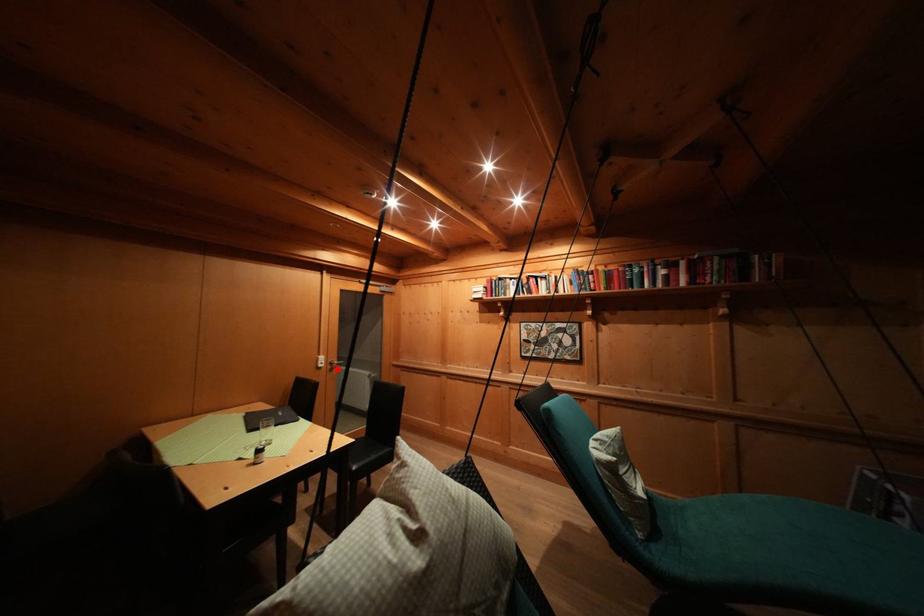
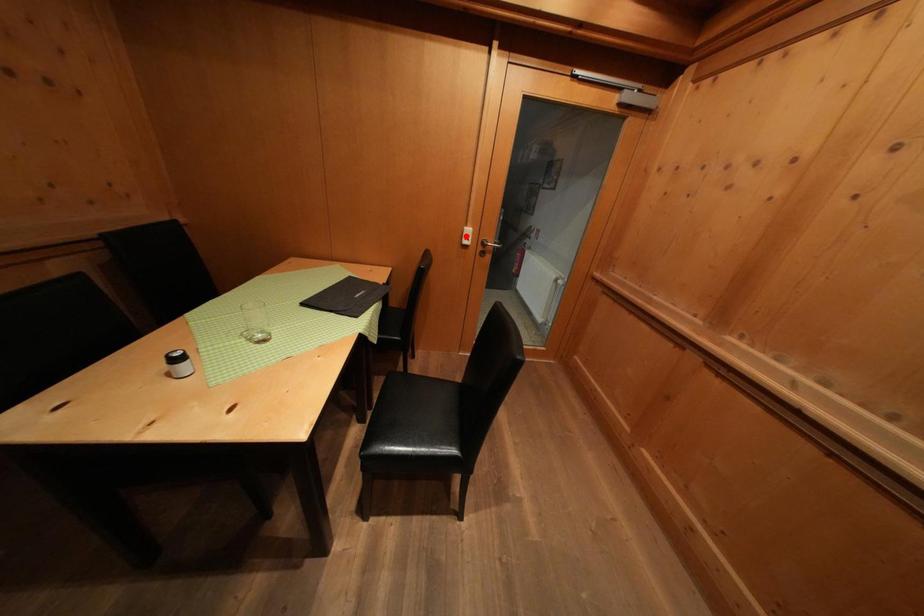
Based on the photo, I am providing you with two images of the same scene from different viewpoints. A red point is marked on the first image and another point is marked on the second image. Is the red point in image1 aligned with the point shown in image2?

No